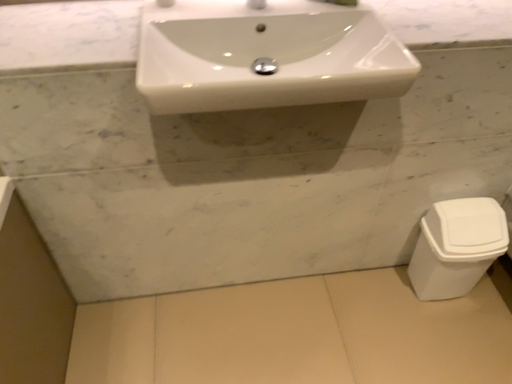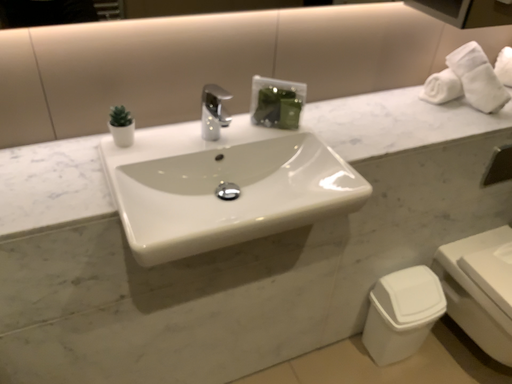
Question: Which way did the camera rotate in the video?

Choices:
 (A) rotated upward
 (B) rotated downward

Answer: (A)